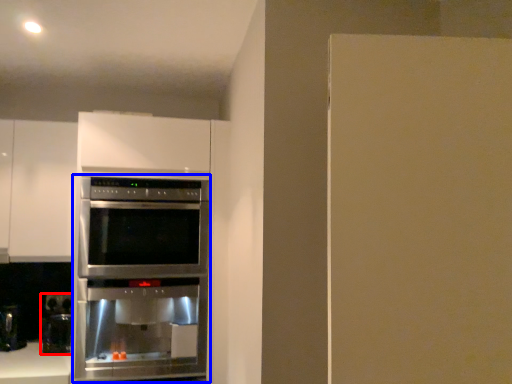
Question: Which of the following is the closest to the observer, coffee machine (highlighted by a red box) or oven (highlighted by a blue box)?

Choices:
 (A) coffee machine
 (B) oven

Answer: (B)